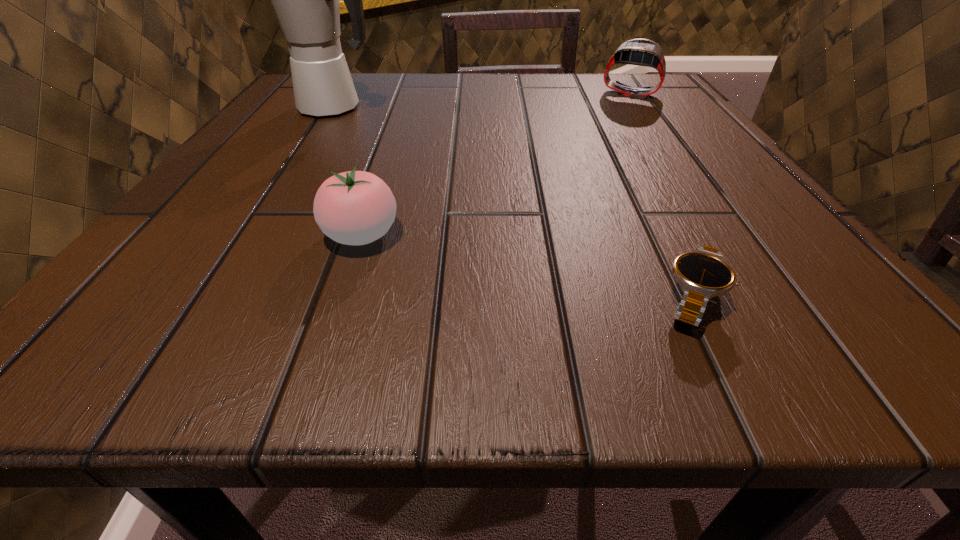
This screenshot has height=540, width=960. Identify the location of free space between the tomato and the taller watch. (495, 164).

Find the location of `object that stands as the second closest to the taller watch`. object that stands as the second closest to the taller watch is located at coordinates (703, 273).

You are a GUI agent. You are given a task and a screenshot of the screen. Output one action in this format:
    pyautogui.click(x=<x>, y=<y>)
    Task: Click on the object that is the closest to the taller watch
    
    Given the screenshot: What is the action you would take?
    pyautogui.click(x=305, y=0)

At what (x,y) coordinates should I click in order to perform the action: click on vacant space that satisfies the following two spatial constraints: 1. on the front side of the tallest object; 2. on the left side of the nearer watch. Please return your answer as a coordinate pair (x, y). The height and width of the screenshot is (540, 960). Looking at the image, I should click on (211, 299).

Locate an element on the screen. free location that satisfies the following two spatial constraints: 1. on the back side of the tallest object; 2. on the right side of the farther watch is located at coordinates (343, 93).

This screenshot has width=960, height=540. Find the location of `vacant area that satisfies the following two spatial constraints: 1. on the front side of the coffeepot; 2. on the right side of the shorter watch`. vacant area that satisfies the following two spatial constraints: 1. on the front side of the coffeepot; 2. on the right side of the shorter watch is located at coordinates (211, 299).